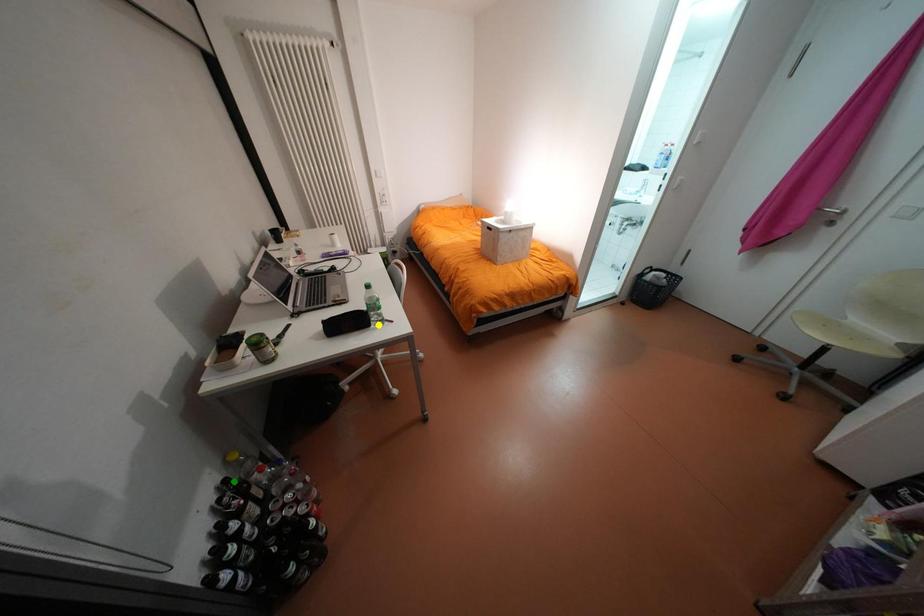
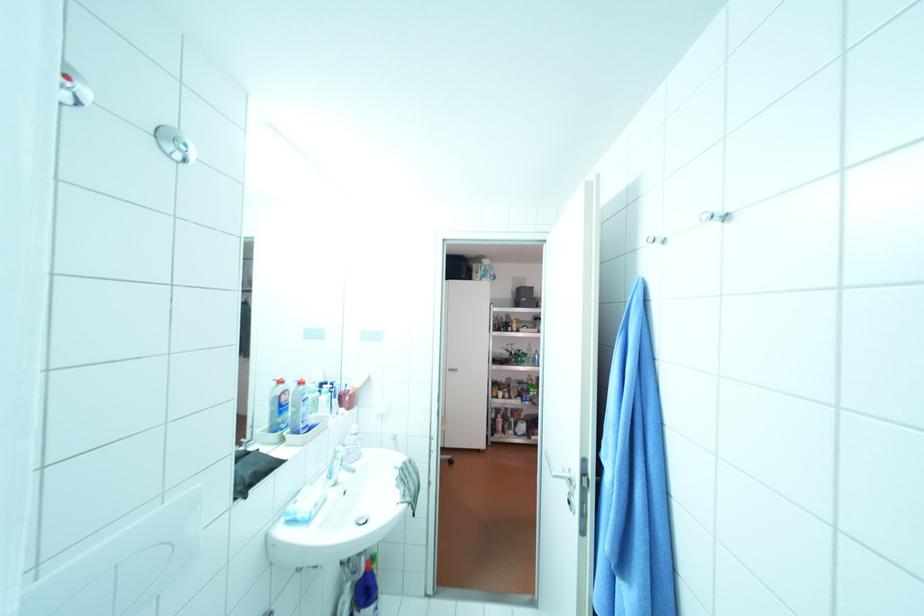
I am providing you with two images of the same scene from different viewpoints. Three points are marked in image1. Which point corresponds to a part or object that is occluded in image2?In image1, three points are marked. Which of them correspond to a part or object that is occluded in image2?Among the three points shown in image1, which one corresponds to a part or object that is no longer visible due to occlusion in image2?

Invisible in image2: blue point, yellow point, green point.